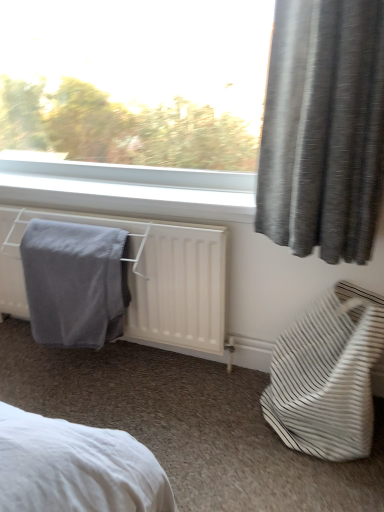
Question: Does white striped fabric bag at lower right have a smaller size compared to gray soft towel at lower left?

Choices:
 (A) yes
 (B) no

Answer: (B)

Question: Is white striped fabric bag at lower right placed right next to gray soft towel at lower left?

Choices:
 (A) no
 (B) yes

Answer: (A)

Question: Is white striped fabric bag at lower right behind gray soft towel at lower left?

Choices:
 (A) no
 (B) yes

Answer: (A)

Question: Is white striped fabric bag at lower right to the left of gray soft towel at lower left from the viewer's perspective?

Choices:
 (A) no
 (B) yes

Answer: (A)

Question: Is the position of white striped fabric bag at lower right less distant than that of gray soft towel at lower left?

Choices:
 (A) no
 (B) yes

Answer: (B)

Question: Does point (66, 263) appear closer or farther from the camera than point (357, 409)?

Choices:
 (A) closer
 (B) farther

Answer: (B)

Question: In terms of width, does gray soft towel at lower left look wider or thinner when compared to white striped fabric bag at lower right?

Choices:
 (A) thin
 (B) wide

Answer: (A)

Question: From the image's perspective, is gray soft towel at lower left positioned above or below white striped fabric bag at lower right?

Choices:
 (A) below
 (B) above

Answer: (B)

Question: From a real-world perspective, is gray soft towel at lower left physically located above or below white striped fabric bag at lower right?

Choices:
 (A) below
 (B) above

Answer: (B)

Question: Considering the relative positions of gray soft towel at lower left and white matte radiator at lower left in the image provided, is gray soft towel at lower left to the left or to the right of white matte radiator at lower left?

Choices:
 (A) left
 (B) right

Answer: (A)

Question: Does point (51, 276) appear closer or farther from the camera than point (196, 238)?

Choices:
 (A) farther
 (B) closer

Answer: (A)

Question: From a real-world perspective, is gray soft towel at lower left physically located above or below white matte radiator at lower left?

Choices:
 (A) below
 (B) above

Answer: (A)

Question: Looking at their shapes, would you say gray soft towel at lower left is wider or thinner than white matte radiator at lower left?

Choices:
 (A) wide
 (B) thin

Answer: (B)

Question: Is point (331, 326) positioned closer to the camera than point (139, 220)?

Choices:
 (A) farther
 (B) closer

Answer: (B)

Question: Considering the relative positions of white striped fabric bag at lower right and white matte radiator at lower left in the image provided, is white striped fabric bag at lower right to the left or to the right of white matte radiator at lower left?

Choices:
 (A) left
 (B) right

Answer: (B)